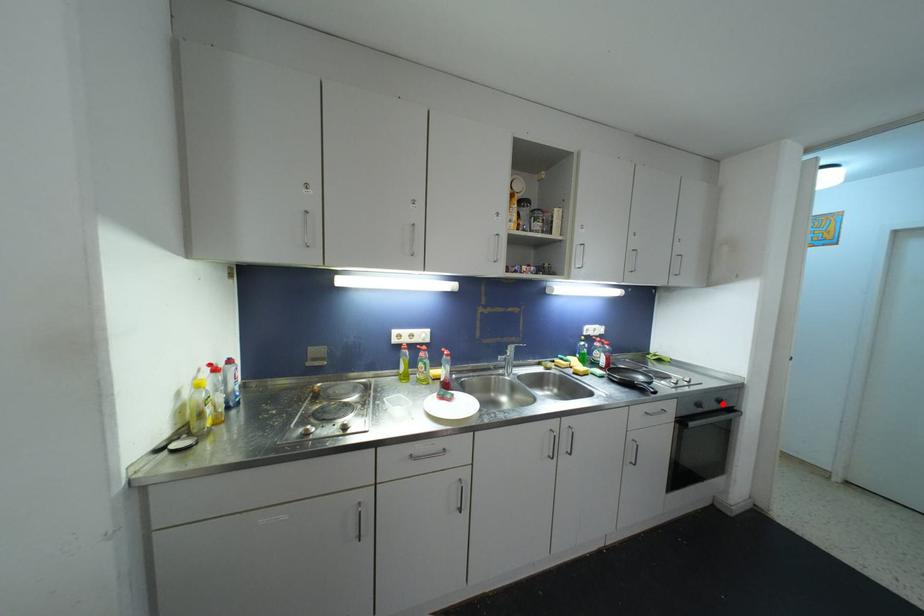
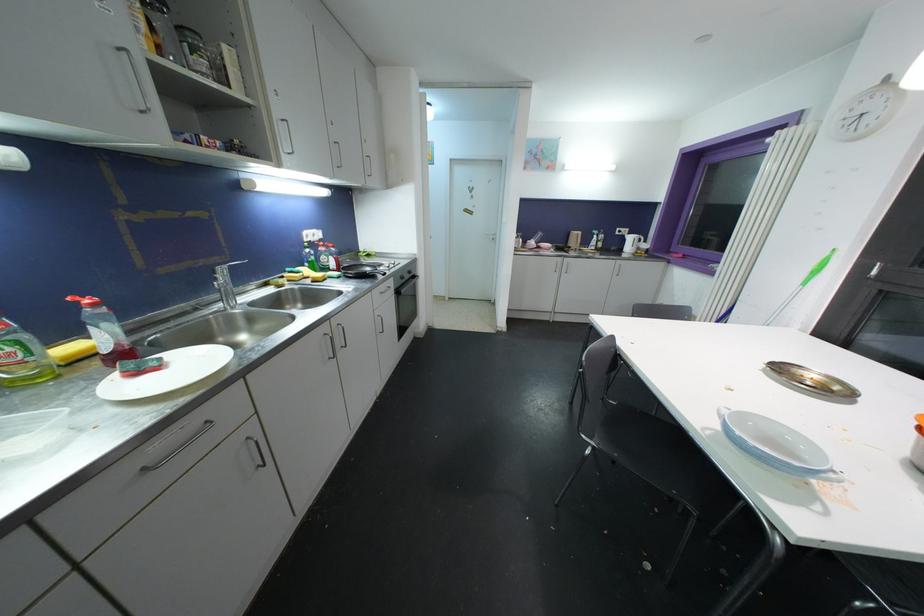
Find the pixel in the second image that matches the highlighted location in the first image.

(412, 275)